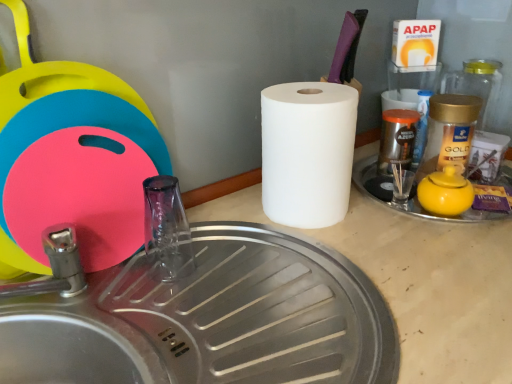
Question: Is transparent glass faucet at center next to yellow matte teapot at right?

Choices:
 (A) no
 (B) yes

Answer: (A)

Question: Can you confirm if transparent glass faucet at center is bigger than yellow matte teapot at right?

Choices:
 (A) no
 (B) yes

Answer: (A)

Question: Are transparent glass faucet at center and yellow matte teapot at right located far from each other?

Choices:
 (A) yes
 (B) no

Answer: (B)

Question: Does transparent glass faucet at center appear on the right side of yellow matte teapot at right?

Choices:
 (A) no
 (B) yes

Answer: (A)

Question: Is the depth of transparent glass faucet at center greater than that of yellow matte teapot at right?

Choices:
 (A) no
 (B) yes

Answer: (A)

Question: Considering the positions of yellow matte teapot at right and brushed metal sink at lower left in the image, is yellow matte teapot at right taller or shorter than brushed metal sink at lower left?

Choices:
 (A) tall
 (B) short

Answer: (B)

Question: Is point (429, 173) positioned closer to the camera than point (263, 312)?

Choices:
 (A) closer
 (B) farther

Answer: (B)

Question: Is yellow matte teapot at right to the left or to the right of brushed metal sink at lower left in the image?

Choices:
 (A) left
 (B) right

Answer: (B)

Question: In terms of width, does yellow matte teapot at right look wider or thinner when compared to brushed metal sink at lower left?

Choices:
 (A) thin
 (B) wide

Answer: (A)

Question: Considering the positions of white matte paper towel at center and brushed metal sink at lower left in the image, is white matte paper towel at center bigger or smaller than brushed metal sink at lower left?

Choices:
 (A) small
 (B) big

Answer: (A)

Question: Considering their positions, is white matte paper towel at center located in front of or behind brushed metal sink at lower left?

Choices:
 (A) front
 (B) behind

Answer: (B)

Question: Considering the positions of white matte paper towel at center and brushed metal sink at lower left in the image, is white matte paper towel at center taller or shorter than brushed metal sink at lower left?

Choices:
 (A) short
 (B) tall

Answer: (B)

Question: Is white matte paper towel at center inside or outside of brushed metal sink at lower left?

Choices:
 (A) outside
 (B) inside

Answer: (A)

Question: Is yellow matte teapot at right wider or thinner than transparent glass faucet at center?

Choices:
 (A) thin
 (B) wide

Answer: (B)

Question: From their relative heights in the image, would you say yellow matte teapot at right is taller or shorter than transparent glass faucet at center?

Choices:
 (A) tall
 (B) short

Answer: (B)